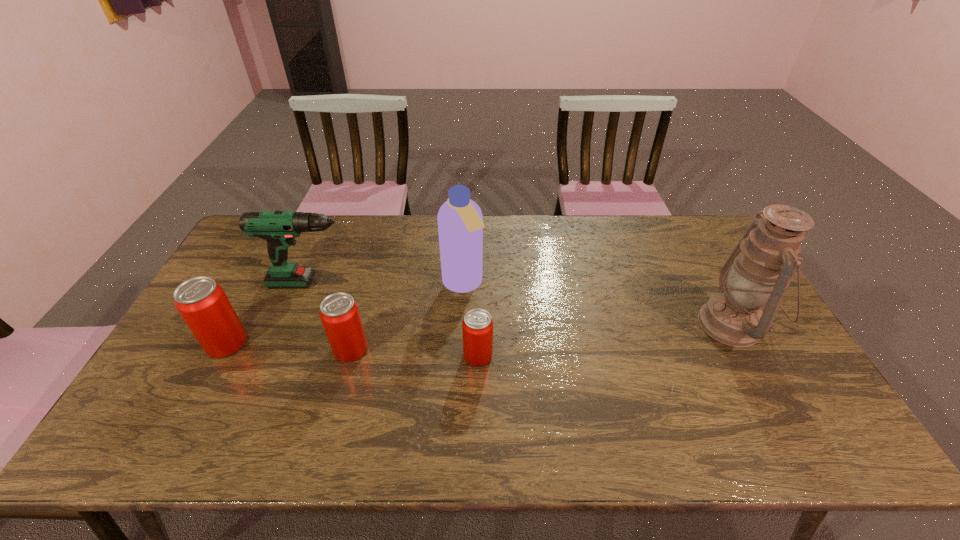
In the image, there is a desktop. At what (x,y) coordinates should I click in order to perform the action: click on blank space at the near right corner. Please return your answer as a coordinate pair (x, y). Looking at the image, I should click on (796, 392).

Where is `blank region between the second tallest object and the oil lamp`? Image resolution: width=960 pixels, height=540 pixels. blank region between the second tallest object and the oil lamp is located at coordinates (597, 304).

I want to click on free space between the leftmost can and the third tallest object, so click(273, 313).

This screenshot has height=540, width=960. Identify the location of free spot between the oil lamp and the third tallest object. (525, 303).

Locate an element on the screen. empty space that is in between the leftmost can and the fourth shortest object is located at coordinates (273, 313).

What are the coordinates of `free space between the drill and the rightmost can` in the screenshot? It's located at click(x=397, y=319).

Image resolution: width=960 pixels, height=540 pixels. I want to click on vacant area that lies between the rightmost can and the oil lamp, so click(x=605, y=340).

Image resolution: width=960 pixels, height=540 pixels. I want to click on free point between the leftmost can and the second shortest can, so click(x=289, y=346).

You are a GUI agent. You are given a task and a screenshot of the screen. Output one action in this format:
    pyautogui.click(x=<x>, y=<y>)
    Task: Click on the vacant space in between the second tallest can and the shortest can
    
    Given the screenshot: What is the action you would take?
    click(x=414, y=353)

The height and width of the screenshot is (540, 960). In order to click on the closest object to the shortest can in this screenshot , I will do `click(460, 221)`.